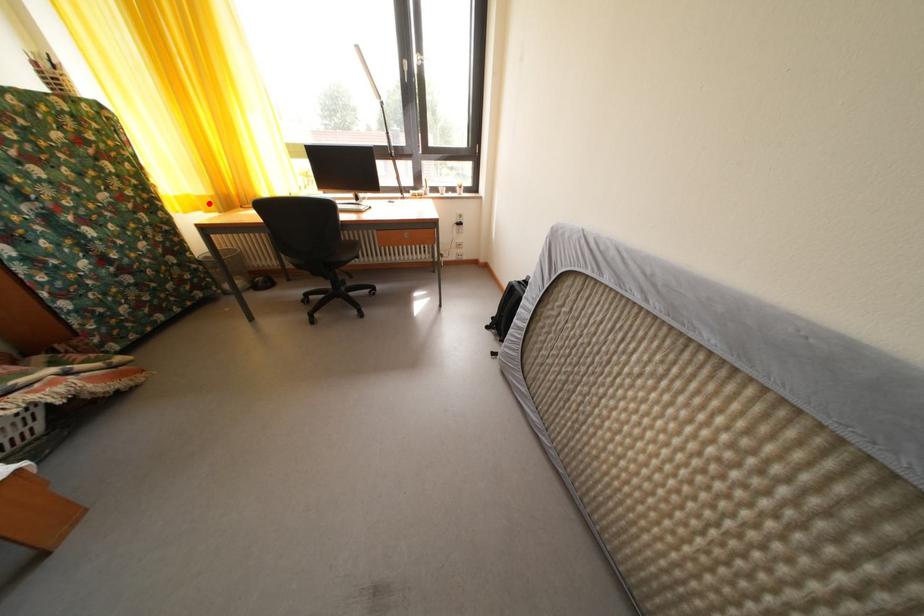
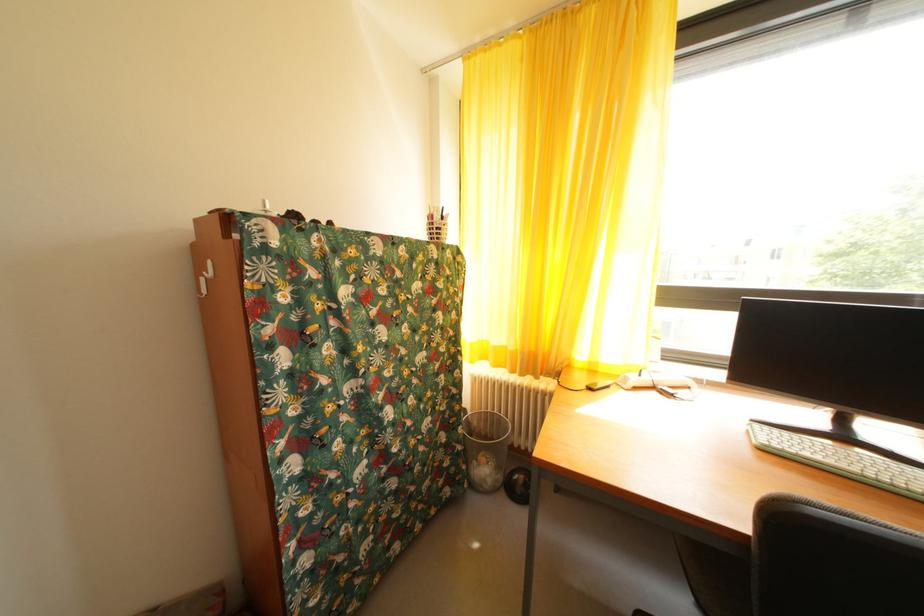
In the second image, find the point that corresponds to the highlighted location in the first image.

(505, 354)